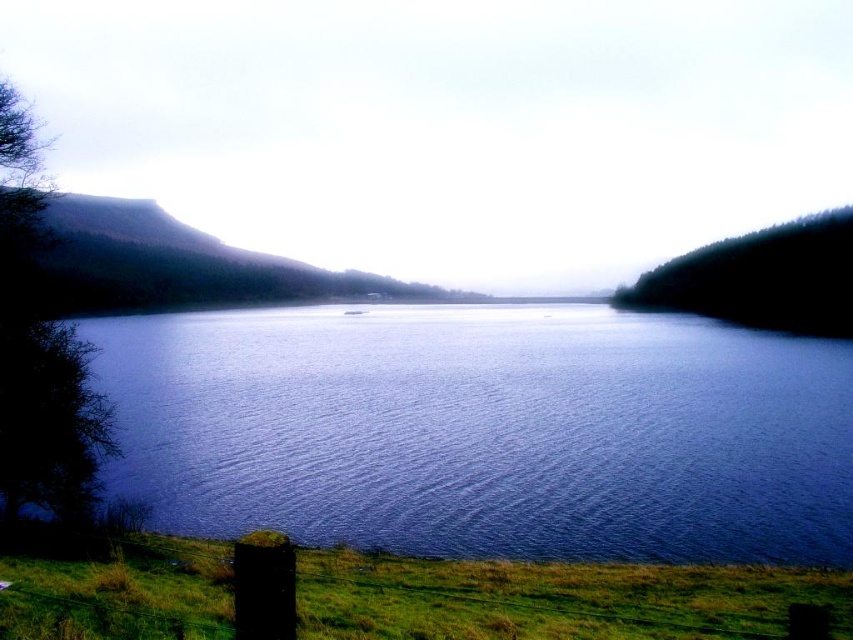
You are standing at the edge of the lake and looking towards the distant hills. There are two points marked in the scene, point (144,337) and point (309,595). Which point is closer to you?

Point (144,337) is further to the camera than point (309,595), so the point closer to you is point (309,595).